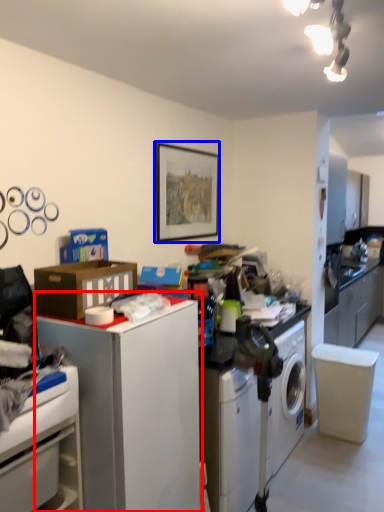
Question: Which of the following is the closest to the observer, file cabinet (highlighted by a red box) or picture frame (highlighted by a blue box)?

Choices:
 (A) file cabinet
 (B) picture frame

Answer: (A)